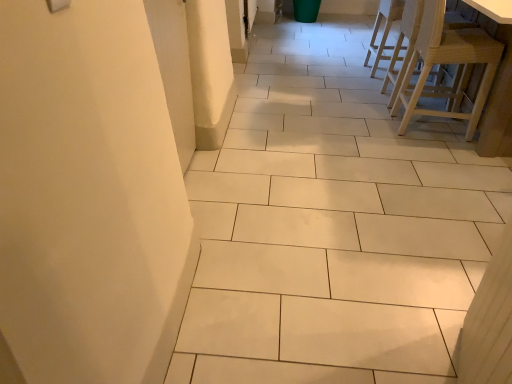
The width and height of the screenshot is (512, 384). In order to click on natural wood chair at upper right, acting as the second chair starting from the front in this screenshot , I will do `click(407, 46)`.

The image size is (512, 384). I want to click on light wood stool at right, which is the 1th chair from front to back, so click(x=447, y=63).

Is natural wood chair at upper right, the 2th chair when ordered from back to front, positioned before light wood stool at right, positioned as the third chair in back-to-front order?

No, natural wood chair at upper right, the 2th chair when ordered from back to front, is further to the viewer.

Consider the image. Is natural wood chair at upper right, acting as the second chair starting from the front, far from light wood stool at right, which is the 1th chair from front to back?

Actually, natural wood chair at upper right, acting as the second chair starting from the front, and light wood stool at right, which is the 1th chair from front to back, are a little close together.

Which is behind, point (414, 0) or point (495, 45)?

The point (414, 0) is behind.

Which of these two, natural wood chair at upper right, acting as the second chair starting from the front, or light wood stool at right, positioned as the third chair in back-to-front order, stands shorter?

natural wood chair at upper right, acting as the second chair starting from the front, is shorter.

In terms of width, does light wood chair at upper right, marked as the 3th chair in a front-to-back arrangement, look wider or thinner when compared to light wood stool at right, which is the 1th chair from front to back?

Clearly, light wood chair at upper right, marked as the 3th chair in a front-to-back arrangement, has less width compared to light wood stool at right, which is the 1th chair from front to back.

From the image's perspective, who appears lower, light wood chair at upper right, which is the first chair from back to front, or light wood stool at right, positioned as the third chair in back-to-front order?

From the image's view, light wood stool at right, positioned as the third chair in back-to-front order, is below.

From a real-world perspective, is light wood chair at upper right, marked as the 3th chair in a front-to-back arrangement, physically below light wood stool at right, which is the 1th chair from front to back?

Correct, in the physical world, light wood chair at upper right, marked as the 3th chair in a front-to-back arrangement, is lower than light wood stool at right, which is the 1th chair from front to back.

Is light wood stool at right, positioned as the third chair in back-to-front order, bigger than light wood chair at upper right, marked as the 3th chair in a front-to-back arrangement?

Yes, light wood stool at right, positioned as the third chair in back-to-front order, is bigger than light wood chair at upper right, marked as the 3th chair in a front-to-back arrangement.

How different are the orientations of light wood stool at right, positioned as the third chair in back-to-front order, and light wood chair at upper right, which is the first chair from back to front, in degrees?

2.51 degrees separate the facing orientations of light wood stool at right, positioned as the third chair in back-to-front order, and light wood chair at upper right, which is the first chair from back to front.

I want to click on the 2nd chair in front of the light wood chair at upper right, which is the first chair from back to front, so click(x=447, y=63).

From a real-world perspective, who is located higher, light wood stool at right, positioned as the third chair in back-to-front order, or light wood chair at upper right, marked as the 3th chair in a front-to-back arrangement?

In real-world perspective, light wood stool at right, positioned as the third chair in back-to-front order, is above.

Does light wood stool at right, positioned as the third chair in back-to-front order, turn towards natural wood chair at upper right, acting as the second chair starting from the front?

No, light wood stool at right, positioned as the third chair in back-to-front order, is not facing towards natural wood chair at upper right, acting as the second chair starting from the front.

Which object is positioned more to the right, light wood stool at right, which is the 1th chair from front to back, or natural wood chair at upper right, the 2th chair when ordered from back to front?

Positioned to the right is natural wood chair at upper right, the 2th chair when ordered from back to front.

Considering the sizes of objects light wood stool at right, which is the 1th chair from front to back, and natural wood chair at upper right, acting as the second chair starting from the front, in the image provided, who is shorter, light wood stool at right, which is the 1th chair from front to back, or natural wood chair at upper right, acting as the second chair starting from the front,?

natural wood chair at upper right, acting as the second chair starting from the front.

From a real-world perspective, which object stands above the other?

From a 3D spatial view, light wood stool at right, positioned as the third chair in back-to-front order, is above.

Locate an element on the screen. the 1st chair located above the light wood chair at upper right, which is the first chair from back to front (from a real-world perspective) is located at coordinates (407, 46).

How many degrees apart are the facing directions of light wood chair at upper right, marked as the 3th chair in a front-to-back arrangement, and natural wood chair at upper right, the 2th chair when ordered from back to front?

light wood chair at upper right, marked as the 3th chair in a front-to-back arrangement, and natural wood chair at upper right, the 2th chair when ordered from back to front, are facing 2.5 degrees away from each other.

Is the depth of light wood chair at upper right, which is the first chair from back to front, greater than that of natural wood chair at upper right, the 2th chair when ordered from back to front?

Yes, the depth of light wood chair at upper right, which is the first chair from back to front, is greater than that of natural wood chair at upper right, the 2th chair when ordered from back to front.

From a real-world perspective, which is physically below, light wood chair at upper right, which is the first chair from back to front, or natural wood chair at upper right, the 2th chair when ordered from back to front?

From a 3D spatial view, light wood chair at upper right, which is the first chair from back to front, is below.

Does point (422, 0) appear closer or farther from the camera than point (385, 2)?

Point (422, 0).

Measure the distance from natural wood chair at upper right, acting as the second chair starting from the front, to light wood chair at upper right, which is the first chair from back to front.

The distance of natural wood chair at upper right, acting as the second chair starting from the front, from light wood chair at upper right, which is the first chair from back to front, is 31.46 centimeters.

Is natural wood chair at upper right, acting as the second chair starting from the front, completely or partially outside of light wood chair at upper right, which is the first chair from back to front?

Indeed, natural wood chair at upper right, acting as the second chair starting from the front, is completely outside light wood chair at upper right, which is the first chair from back to front.

From the image's perspective, between natural wood chair at upper right, acting as the second chair starting from the front, and light wood chair at upper right, marked as the 3th chair in a front-to-back arrangement, who is located below?

From the image's view, natural wood chair at upper right, acting as the second chair starting from the front, is below.

There is a light wood stool at right, which is the 1th chair from front to back. Where is `the 1st chair above it (from the image's perspective)`? the 1st chair above it (from the image's perspective) is located at coordinates (407, 46).

Identify the location of the 2nd chair in front of the light wood chair at upper right, which is the first chair from back to front. (447, 63).

Based on their spatial positions, is natural wood chair at upper right, acting as the second chair starting from the front, or light wood chair at upper right, marked as the 3th chair in a front-to-back arrangement, further from light wood stool at right, positioned as the third chair in back-to-front order?

light wood chair at upper right, marked as the 3th chair in a front-to-back arrangement.

Considering their positions, is natural wood chair at upper right, acting as the second chair starting from the front, positioned closer to light wood chair at upper right, which is the first chair from back to front, than light wood stool at right, positioned as the third chair in back-to-front order?

natural wood chair at upper right, acting as the second chair starting from the front, lies closer to light wood chair at upper right, which is the first chair from back to front, than the other object.

When comparing their distances from light wood stool at right, which is the 1th chair from front to back, does light wood chair at upper right, which is the first chair from back to front, or natural wood chair at upper right, the 2th chair when ordered from back to front, seem further?

light wood chair at upper right, which is the first chair from back to front, lies further to light wood stool at right, which is the 1th chair from front to back, than the other object.

Which object lies further to the anchor point natural wood chair at upper right, acting as the second chair starting from the front, light wood chair at upper right, which is the first chair from back to front, or light wood stool at right, which is the 1th chair from front to back?

The object further to natural wood chair at upper right, acting as the second chair starting from the front, is light wood chair at upper right, which is the first chair from back to front.

When comparing their distances from natural wood chair at upper right, the 2th chair when ordered from back to front, does light wood stool at right, positioned as the third chair in back-to-front order, or light wood chair at upper right, marked as the 3th chair in a front-to-back arrangement, seem further?

Based on the image, light wood chair at upper right, marked as the 3th chair in a front-to-back arrangement, appears to be further to natural wood chair at upper right, the 2th chair when ordered from back to front.

From the image, which object appears to be farther from light wood chair at upper right, marked as the 3th chair in a front-to-back arrangement, light wood stool at right, which is the 1th chair from front to back, or natural wood chair at upper right, the 2th chair when ordered from back to front?

light wood stool at right, which is the 1th chair from front to back.

Locate an element on the screen. This screenshot has width=512, height=384. chair positioned between light wood stool at right, which is the 1th chair from front to back, and light wood chair at upper right, which is the first chair from back to front, from near to far is located at coordinates (407, 46).